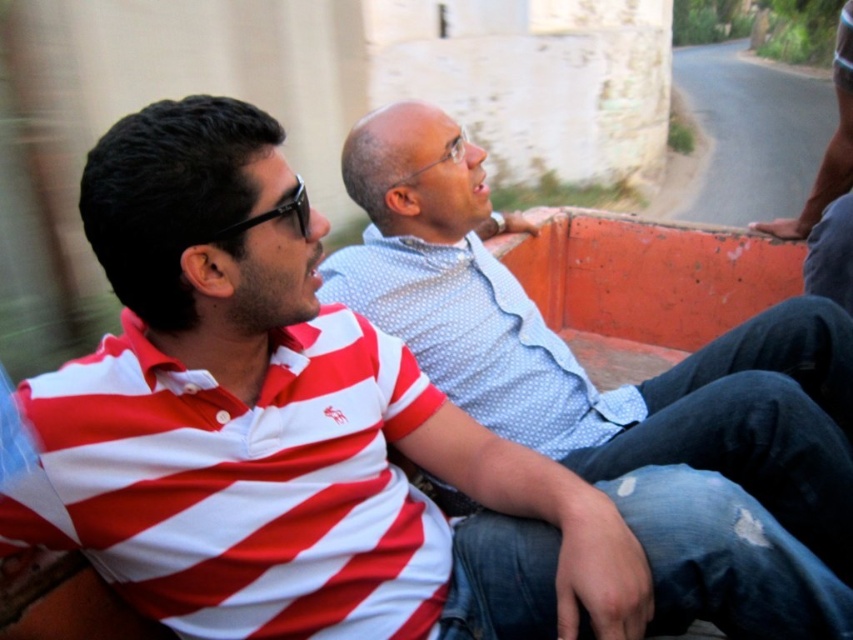
Which is behind, point (328, 260) or point (842, 250)?

Positioned behind is point (842, 250).

At what (x,y) coordinates should I click in order to perform the action: click on white dotted shirt at center. Please return your answer as a coordinate pair (x, y). The image size is (853, 640). Looking at the image, I should click on (479, 339).

Who is more distant from viewer, (466,342) or (808,212)?

The point (808,212) is behind.

Where is `white dotted shirt at center`? The image size is (853, 640). white dotted shirt at center is located at coordinates (479, 339).